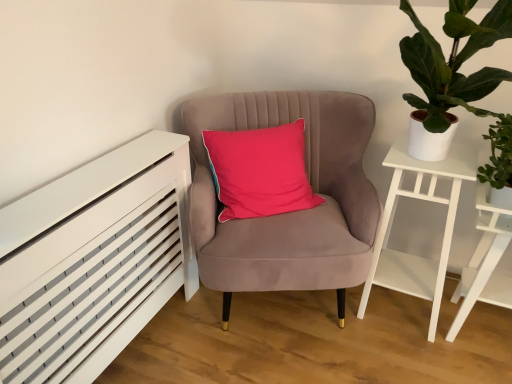
Question: Is velvet pink chair at center bigger or smaller than white matte side table at right?

Choices:
 (A) big
 (B) small

Answer: (A)

Question: Considering the positions of velvet pink chair at center and white matte side table at right in the image, is velvet pink chair at center wider or thinner than white matte side table at right?

Choices:
 (A) thin
 (B) wide

Answer: (B)

Question: Which is farther from the white wooden side table at right?

Choices:
 (A) velvet pink chair at center
 (B) white matte side table at right
 (C) green leafy plant at right

Answer: (A)

Question: Estimate the real-world distances between objects in this image. Which object is closer to the velvet pink chair at center?

Choices:
 (A) white wooden side table at right
 (B) green leafy plant at right
 (C) white matte side table at right

Answer: (C)